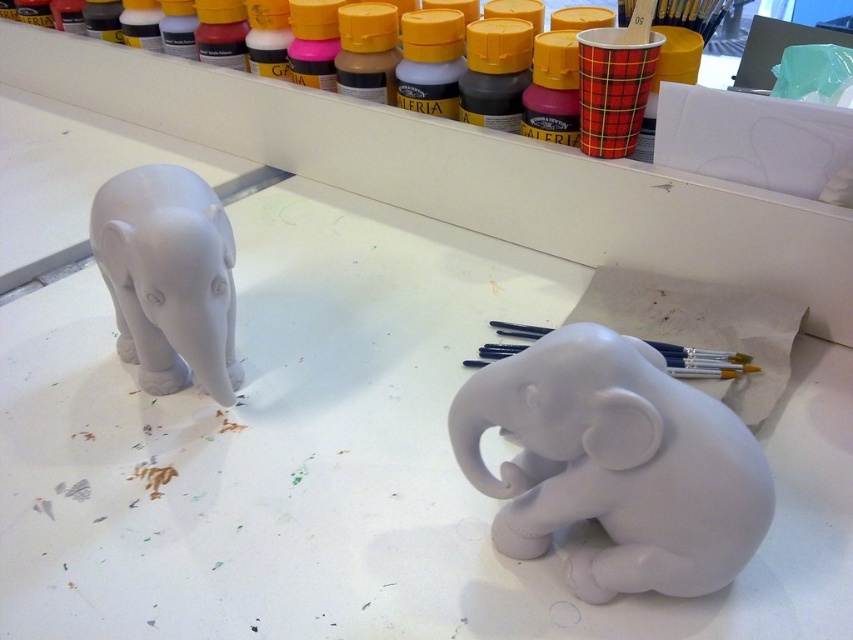
You are an artist who wants to ensure the white matte elephant at lower right is within a safe distance for handling. Given that the recommended handling distance is 24 inches, is the elephant within the safe range?

The white matte elephant at lower right is 26.44 inches away from the viewer, which exceeds the recommended handling distance of 24 inches. Therefore, it is slightly beyond the safe range.

You are setting up a display for an art exhibition. You need to place a small white elephant exactly at the point marked by coordinates point (x=614, y=465). Which object from the image should you place there?

The white matte elephant at lower right is located at point (x=614, y=465), so you should place that object there.

You are organizing a display for an art exhibition and need to arrange the white matte elephant at lower right and the white matte elephant at left. Which elephant should you place on the lower shelf if you want the taller one to be visible from above?

The white matte elephant at left should be placed on the lower shelf because it is taller than the white matte elephant at lower right, ensuring visibility from above.